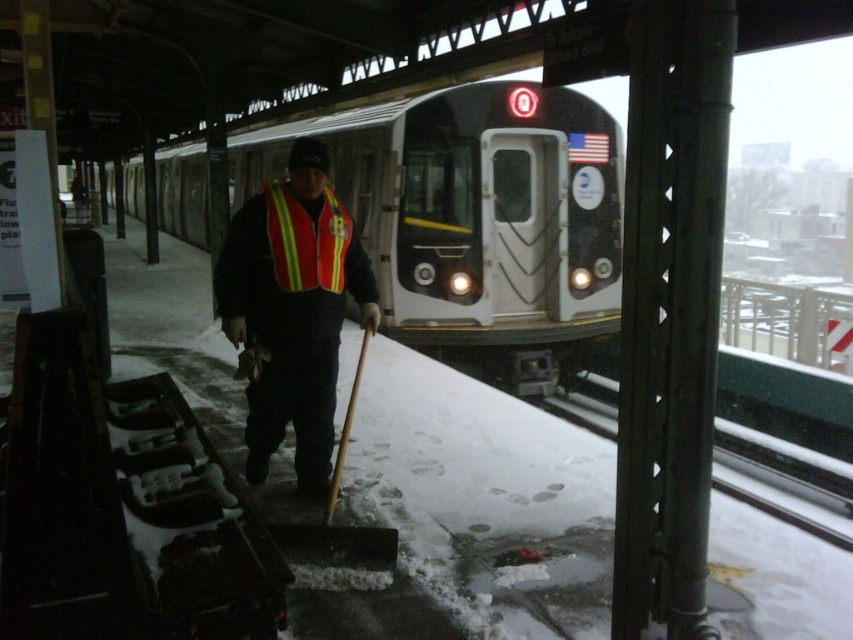
Question: Is reflective orange vest at center closer to the viewer compared to metal at right?

Choices:
 (A) no
 (B) yes

Answer: (B)

Question: Among these objects, which one is nearest to the camera?

Choices:
 (A) reflective orange vest at center
 (B) matte black train at center

Answer: (A)

Question: Which of these objects is positioned closest to the matte black train at center?

Choices:
 (A) reflective orange vest at center
 (B) reflective fabric safety vest at center
 (C) metal at right
 (D) wooden shovel at center

Answer: (A)

Question: Does matte black train at center have a smaller size compared to reflective fabric safety vest at center?

Choices:
 (A) yes
 (B) no

Answer: (B)

Question: Is matte black train at center positioned at the back of wooden shovel at center?

Choices:
 (A) no
 (B) yes

Answer: (B)

Question: Which object appears farthest from the camera in this image?

Choices:
 (A) matte black train at center
 (B) reflective orange vest at center

Answer: (A)